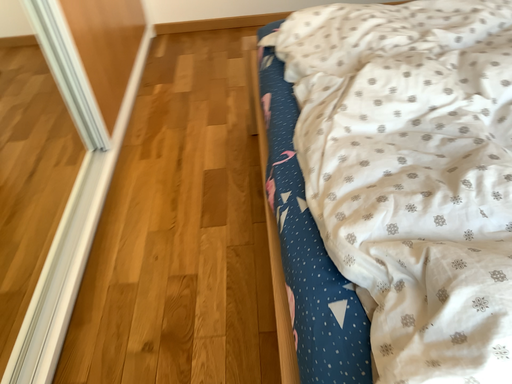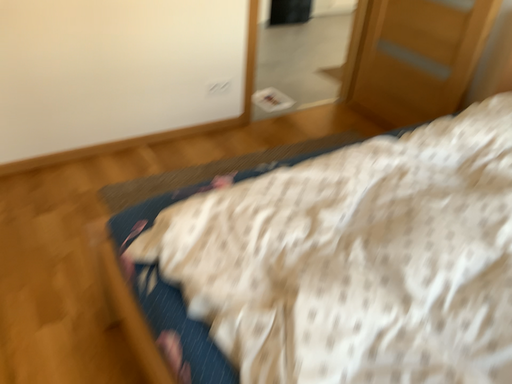
Question: Which way did the camera rotate in the video?

Choices:
 (A) rotated upward
 (B) rotated downward

Answer: (A)